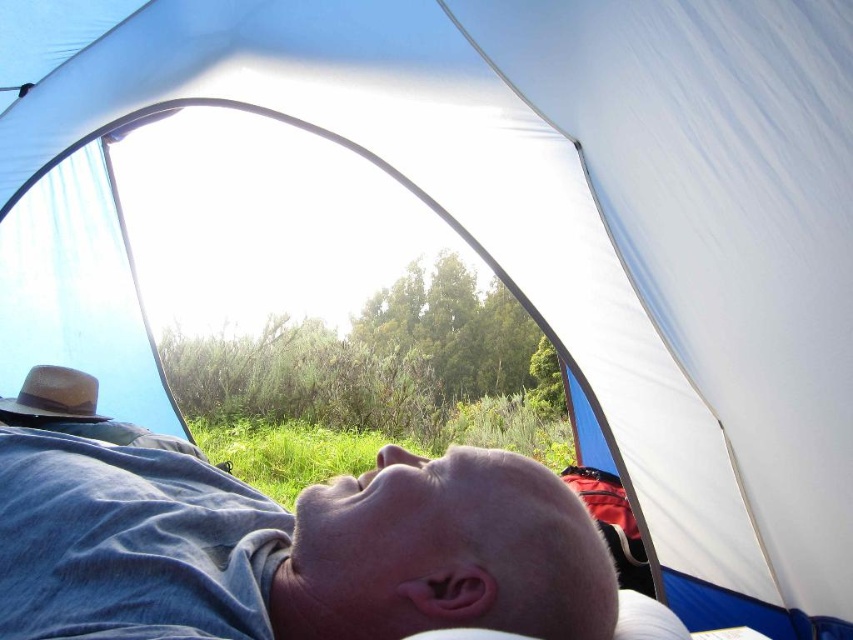
Can you confirm if smooth skin head at lower center is positioned to the right of brown straw hat at left?

Indeed, smooth skin head at lower center is positioned on the right side of brown straw hat at left.

Consider the image. Does smooth skin head at lower center have a lesser height compared to brown straw hat at left?

Incorrect, smooth skin head at lower center's height does not fall short of brown straw hat at left's.

This screenshot has width=853, height=640. Find the location of `smooth skin head at lower center`. smooth skin head at lower center is located at coordinates (289, 548).